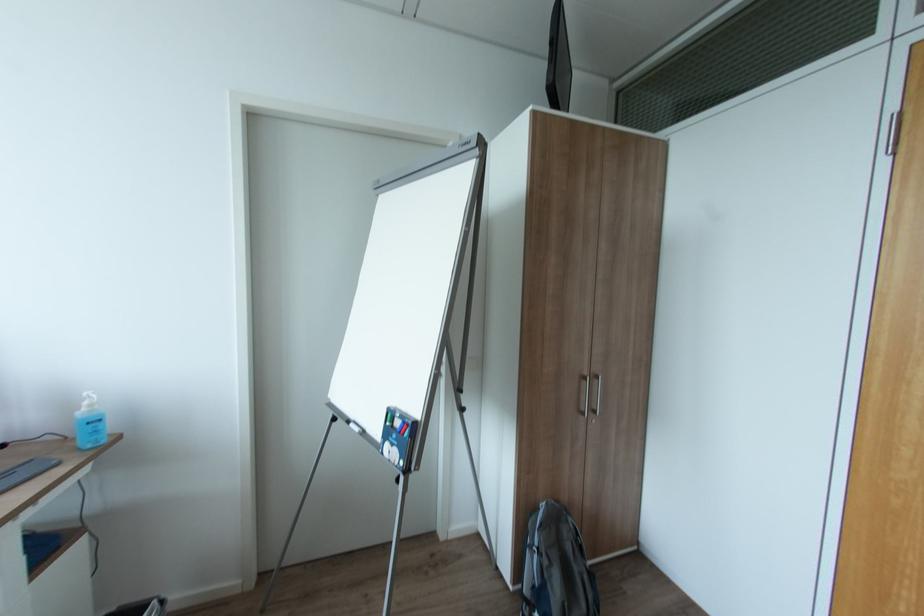
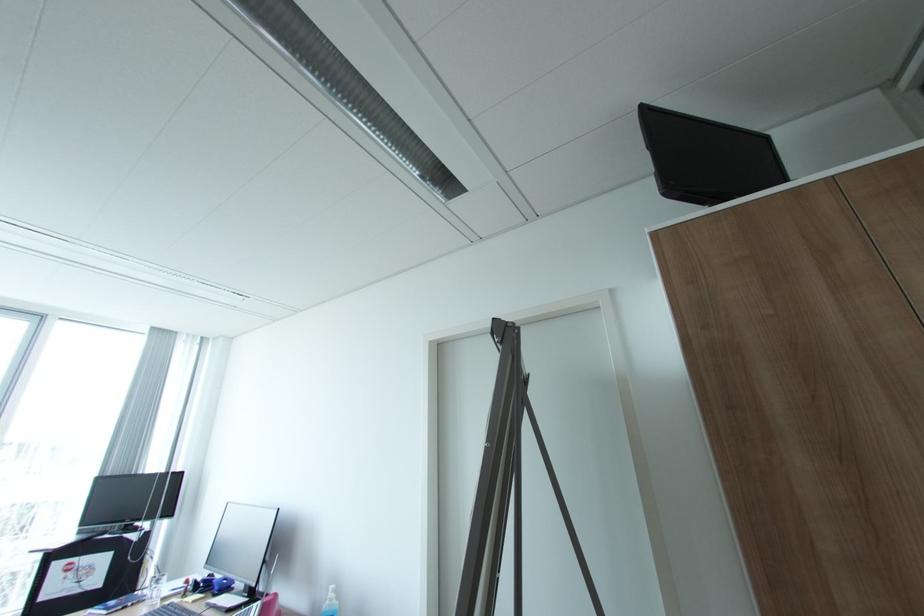
Where in the second image is the point corresponding to pixel 94 407 from the first image?

(336, 599)